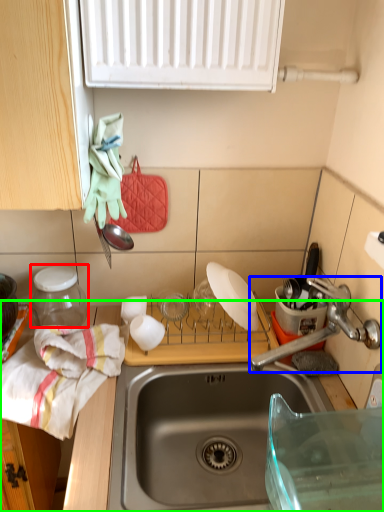
Question: Considering the real-world distances, which object is farthest from appliance (highlighted by a red box)? tap (highlighted by a blue box) or countertop (highlighted by a green box)?

Choices:
 (A) tap
 (B) countertop

Answer: (A)